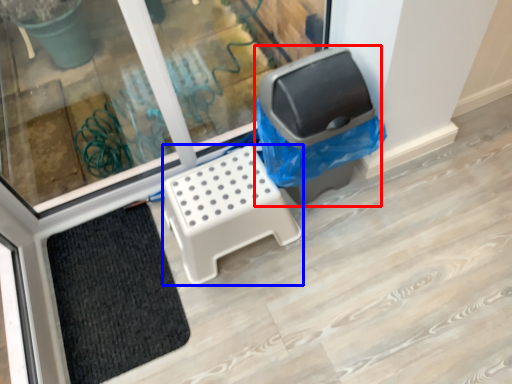
Question: Which object is closer to the camera taking this photo, recycling bin (highlighted by a red box) or furniture (highlighted by a blue box)?

Choices:
 (A) recycling bin
 (B) furniture

Answer: (A)